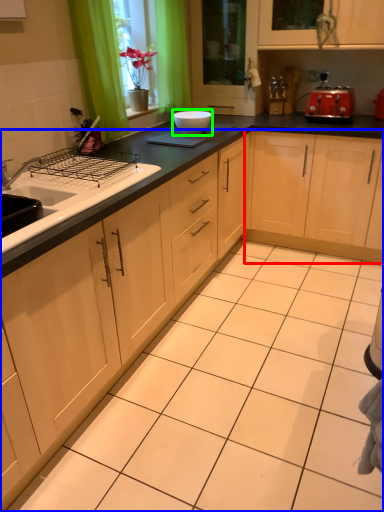
Question: Based on their relative distances, which object is nearer to cabinetry (highlighted by a red box)? Choose from cabinetry (highlighted by a blue box) and bowl (highlighted by a green box).

Choices:
 (A) cabinetry
 (B) bowl

Answer: (B)